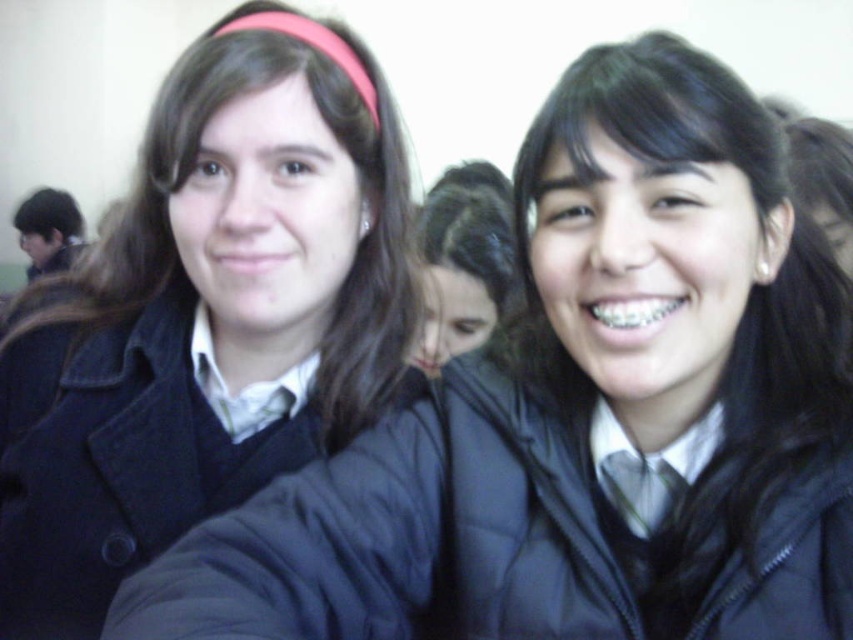
You are a photographer trying to capture a group photo of the two individuals in the scene. Since the matte black coat at left and the dark brown hair at center are in your frame, which one should you zoom in on to make them appear larger in the photo?

The matte black coat at left is smaller than the dark brown hair at center, so to make them appear larger in the photo, you should zoom in on the matte black coat at left.

You are standing in the school hallway and want to take a photo of the two points marked in the image. Which point, point [213,301] or point [471,163], is closer to you?

Point [213,301] is closer to the viewer than point [471,163].